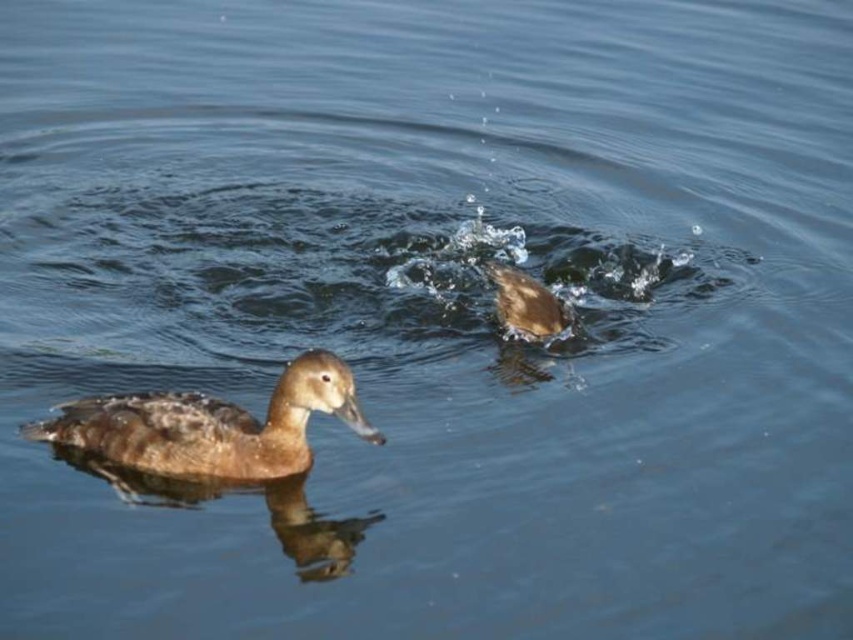
You are observing two ducks in a pond. The brown fuzzy duck at lower left and the brown fuzzy duck at center are both visible. Which duck is positioned lower in the image?

The brown fuzzy duck at lower left is positioned lower in the image than the brown fuzzy duck at center.

You are a wildlife photographer trying to capture a photo of both ducks. You want to ensure that both the brown fuzzy duck at lower left and the brown fuzzy duck at center are fully visible in your shot. Based on their positions, which duck do you need to frame more carefully to avoid cropping part of it?

The brown fuzzy duck at lower left might be wider than brown fuzzy duck at center, so you need to frame the brown fuzzy duck at lower left more carefully to ensure it fits entirely within the photo.

You are standing on a wooden dock observing the brown fuzzy duck at lower left. If you want to throw a small pebble to reach the duck, will the distance be within 10 feet?

The brown fuzzy duck at lower left is 11.43 feet away from viewer, so the distance is more than 10 feet. The pebble will not reach the duck.